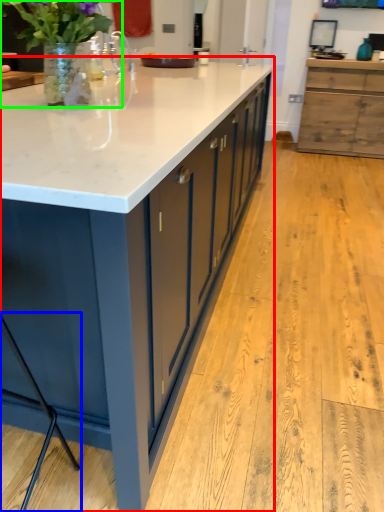
Question: Which object is positioned closest to countertop (highlighted by a red box)? Select from bar stool (highlighted by a blue box) and houseplant (highlighted by a green box).

Choices:
 (A) bar stool
 (B) houseplant

Answer: (B)